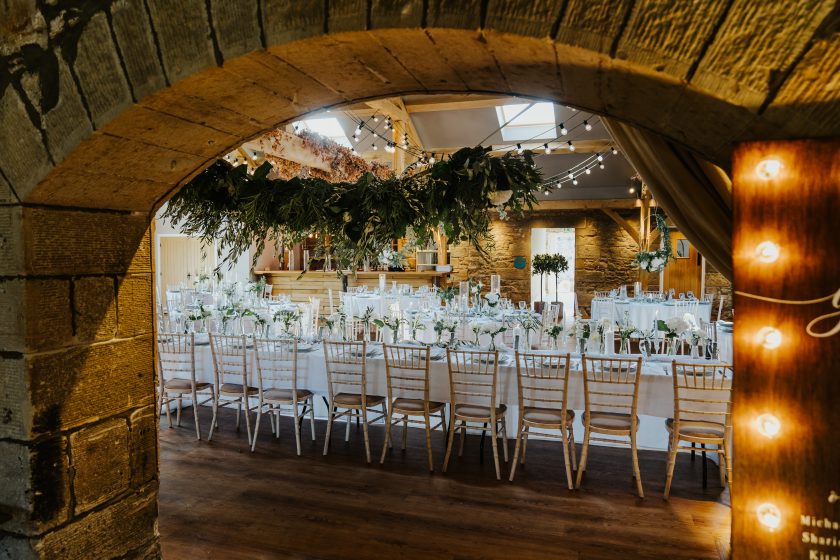
This screenshot has height=560, width=840. I want to click on string lights, so click(x=564, y=136).